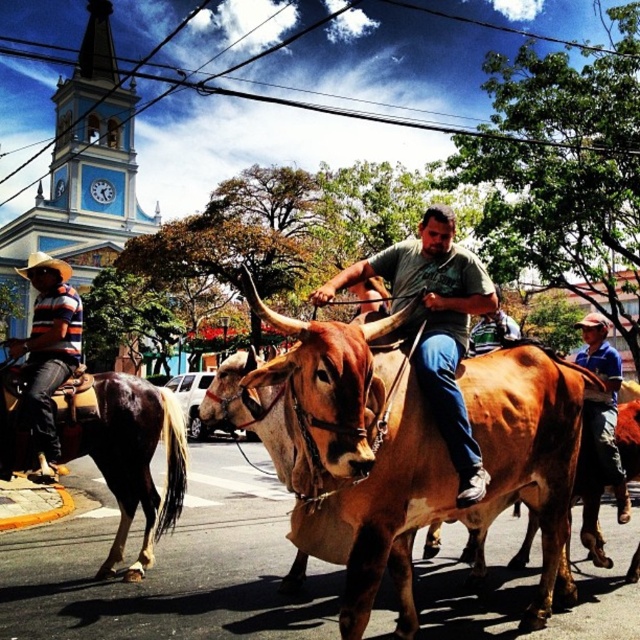
Is brown glossy horse at lower left bigger than striped cotton shirt at left?

Incorrect, brown glossy horse at lower left is not larger than striped cotton shirt at left.

Is brown glossy horse at lower left to the left of striped cotton shirt at left from the viewer's perspective?

In fact, brown glossy horse at lower left is to the right of striped cotton shirt at left.

Image resolution: width=640 pixels, height=640 pixels. In order to click on brown glossy horse at lower left in this screenshot , I will do `click(129, 456)`.

Is brown leather bull at center positioned before matte green shirt at center?

Yes.

You are a GUI agent. You are given a task and a screenshot of the screen. Output one action in this format:
    pyautogui.click(x=<x>, y=<y>)
    Task: Click on the brown leather bull at center
    Image resolution: width=640 pixels, height=640 pixels.
    Given the screenshot: What is the action you would take?
    pyautogui.click(x=413, y=451)

Is point (516, 410) positioned in front of point (458, 476)?

That is False.

Where is `brown leather bull at center`? brown leather bull at center is located at coordinates [413, 451].

Between point (483, 477) and point (13, 358), which one is positioned behind?

The point (13, 358) is behind.

Is the position of matte green shirt at center less distant than that of striped cotton shirt at left?

Yes, it is in front of striped cotton shirt at left.

Is point (449, 285) positioned before point (51, 285)?

Yes, point (449, 285) is in front of point (51, 285).

This screenshot has height=640, width=640. Find the location of `matte green shirt at center`. matte green shirt at center is located at coordinates point(435,326).